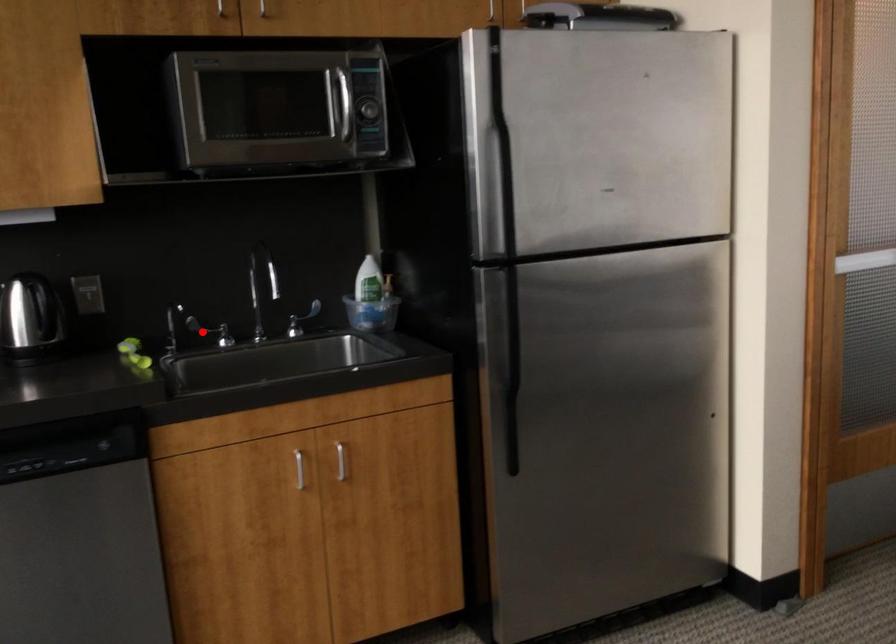
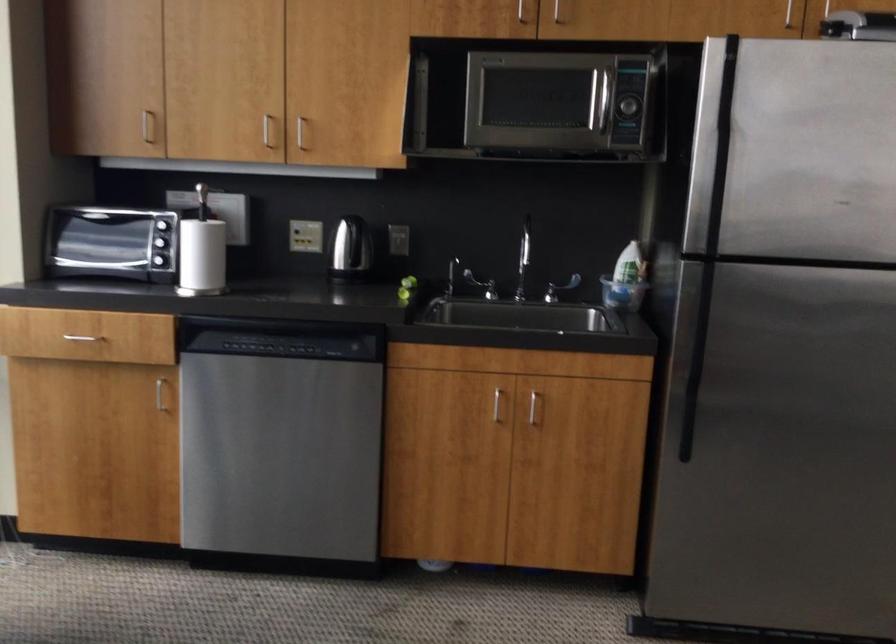
Question: I am providing you with two images of the same scene from different viewpoints. Given a red point in image1, look at the same physical point in image2. Is it:

Choices:
 (A) Closer to the viewpoint
 (B) Farther from the viewpoint

Answer: (B)